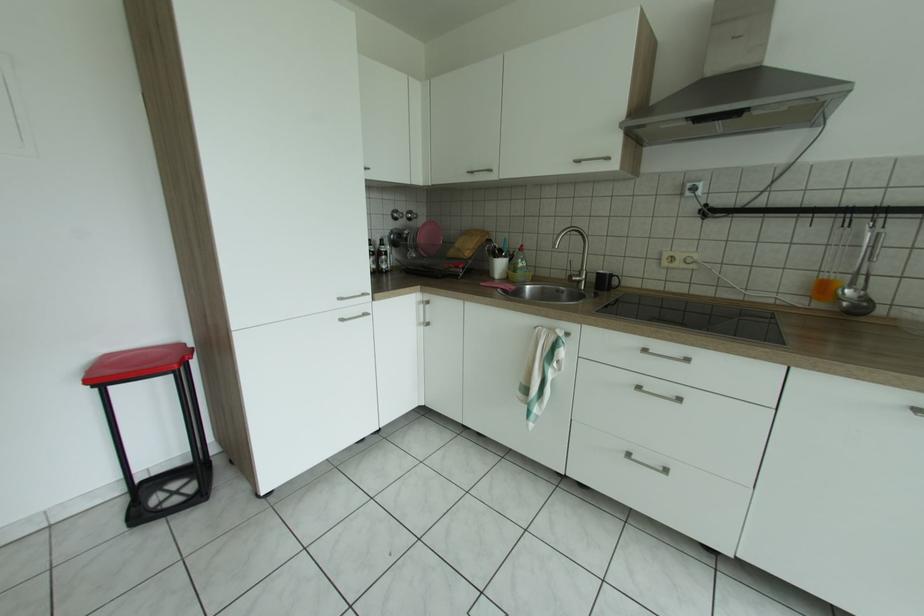
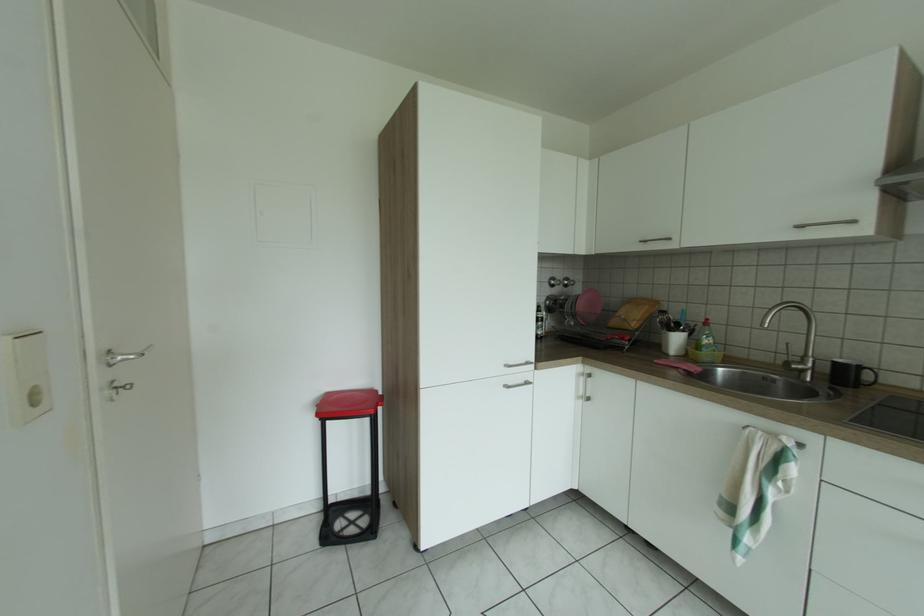
Question: In a continuous first-person perspective shot, in which direction is the camera moving?

Choices:
 (A) Left
 (B) Right
 (C) Forward
 (D) Backward

Answer: (A)